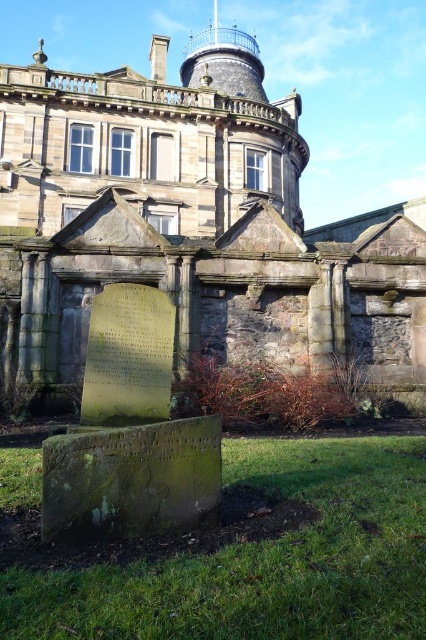
Which is below, green mossy stone monument at lower left or green mossy stone gravestone at lower center?

green mossy stone gravestone at lower center

Does green mossy stone monument at lower left have a smaller size compared to green mossy stone gravestone at lower center?

Yes.

Is point (114, 349) less distant than point (51, 467)?

No, (114, 349) is behind (51, 467).

This screenshot has height=640, width=426. I want to click on green mossy stone monument at lower left, so click(x=129, y=433).